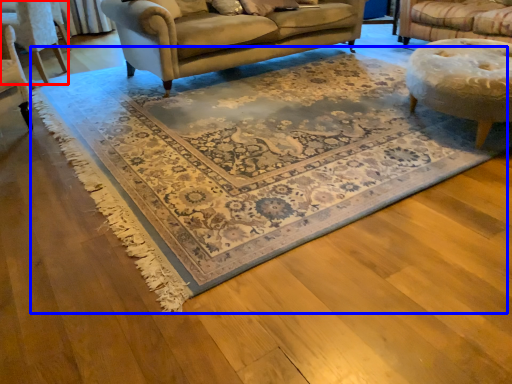
Question: Which object is further to the camera taking this photo, chair (highlighted by a red box) or mat (highlighted by a blue box)?

Choices:
 (A) chair
 (B) mat

Answer: (A)